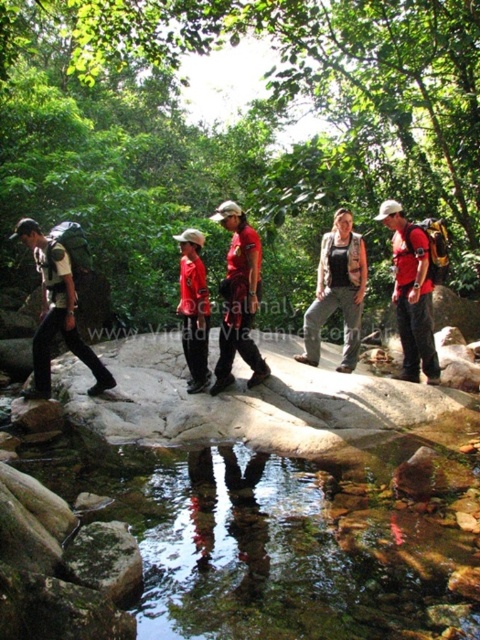
Between matte black backpack at left and red matte shirt at center, which one has more height?

red matte shirt at center

From the picture: Does matte black backpack at left have a larger size compared to red matte shirt at center?

Correct, matte black backpack at left is larger in size than red matte shirt at center.

Find the location of `matte black backpack at left`. matte black backpack at left is located at coordinates (57, 310).

At what (x,y) coordinates should I click in order to perform the action: click on matte black backpack at left. Please return your answer as a coordinate pair (x, y). The image size is (480, 640). Looking at the image, I should click on (57, 310).

From the picture: Between clear glass water at center and red matte shirt at center, which one is positioned higher?

red matte shirt at center is higher up.

Between clear glass water at center and red matte shirt at center, which one appears on the left side from the viewer's perspective?

From the viewer's perspective, clear glass water at center appears more on the left side.

What do you see at coordinates (282, 536) in the screenshot? Image resolution: width=480 pixels, height=640 pixels. I see `clear glass water at center` at bounding box center [282, 536].

What are the coordinates of `clear glass water at center` in the screenshot? It's located at (282, 536).

Based on the photo, is green matte forest at center taller than matte black backpack at left?

Yes.

Measure the distance between green matte forest at center and matte black backpack at left.

green matte forest at center is 12.87 meters away from matte black backpack at left.

Does point (26, 68) come farther from viewer compared to point (99, 385)?

Yes.

Identify the location of green matte forest at center. This screenshot has width=480, height=640. (236, 134).